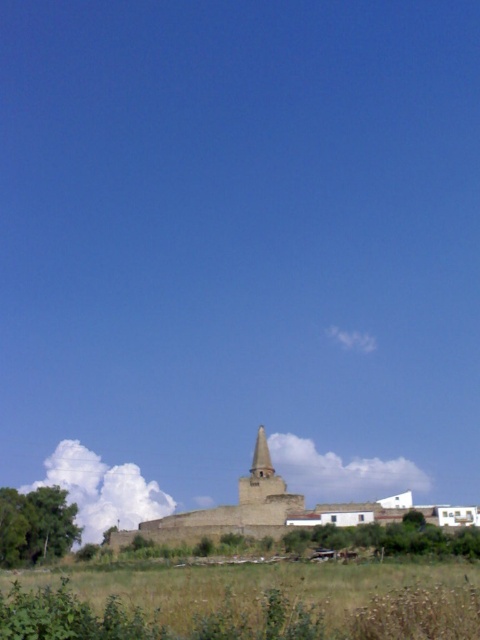
Does green grassy field at lower center have a larger size compared to smooth stone tower at center?

Correct, green grassy field at lower center is larger in size than smooth stone tower at center.

Does green grassy field at lower center have a lesser height compared to smooth stone tower at center?

No.

Locate an element on the screen. green grassy field at lower center is located at coordinates (299, 596).